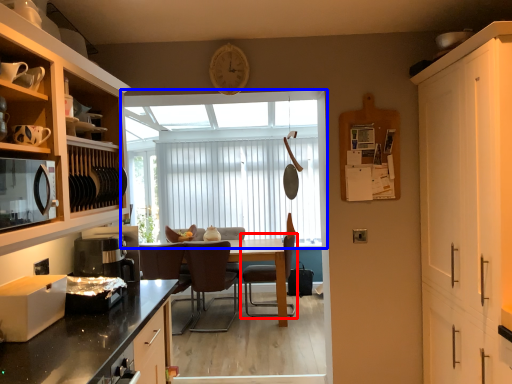
Question: Which object appears farthest to the camera in this image, chair (highlighted by a red box) or window (highlighted by a blue box)?

Choices:
 (A) chair
 (B) window

Answer: (B)